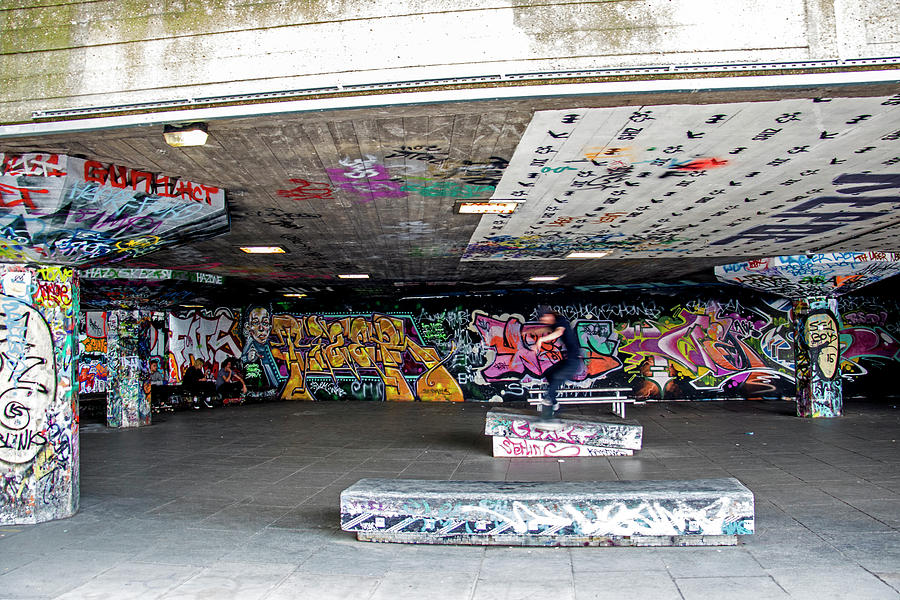
Find the location of a particular element. The width and height of the screenshot is (900, 600). pink writing on grey ceiling is located at coordinates (381, 165), (374, 188).